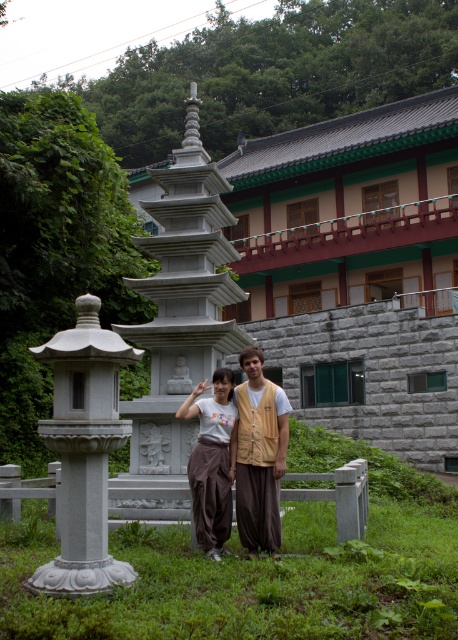
Question: Is white stone lantern at left above brown cotton pants at center?

Choices:
 (A) no
 (B) yes

Answer: (B)

Question: Estimate the real-world distances between objects in this image. Which object is closer to the white stone lantern at left?

Choices:
 (A) matte white pants at center
 (B) brown cotton pants at center

Answer: (A)

Question: Is white stone lantern at left above brown cotton pants at center?

Choices:
 (A) yes
 (B) no

Answer: (A)

Question: Which of the following is the closest to the observer?

Choices:
 (A) (272, 452)
 (B) (115, 408)

Answer: (B)

Question: Which of the following is the closest to the observer?

Choices:
 (A) (245, 452)
 (B) (207, 444)
 (C) (96, 435)

Answer: (C)

Question: From the image, what is the correct spatial relationship of brown cotton pants at center in relation to matte white pants at center?

Choices:
 (A) below
 (B) above

Answer: (B)